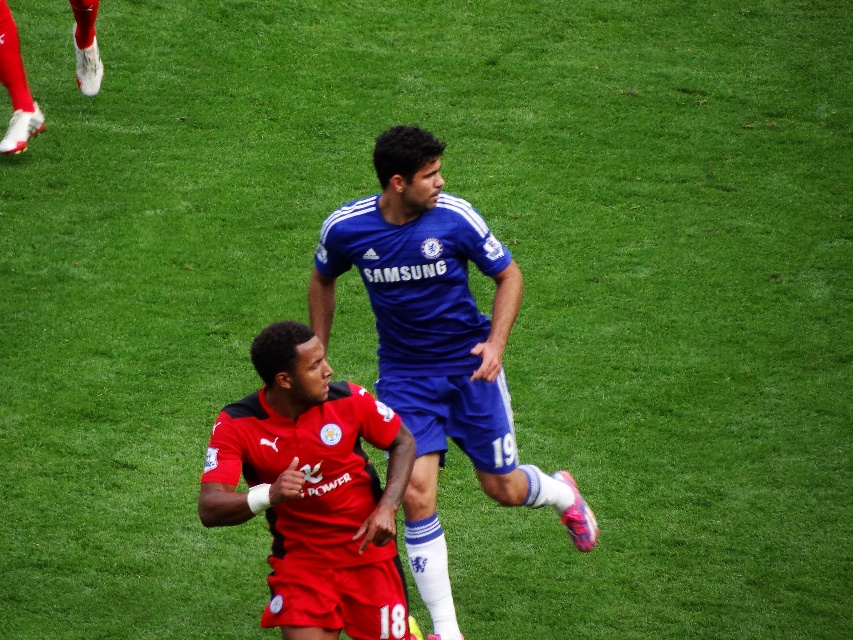
You are a photographer at the soccer match. You want to capture a photo of the blue fabric soccer player at center and the blue jersey at center. Which one should you focus on if you want to highlight the taller object in your shot?

The blue fabric soccer player at center is taller than the blue jersey at center, so you should focus on the blue fabric soccer player at center to highlight the taller object.

You are a referee watching the soccer match. You notice the blue fabric soccer player at center and the red jersey at center. Which one is covering part of the other?

The blue fabric soccer player at center is positioned over the red jersey at center, meaning it is covering part of the red jersey at center.

You are a soccer fan watching the match. You notice two blue items at the center of the field. One is labeled as the blue fabric soccer player at center, and the other is the blue jersey at center. Which one is positioned more to the right?

The blue fabric soccer player at center is positioned to the right of the blue jersey at center, so the blue fabric soccer player at center is more to the right.